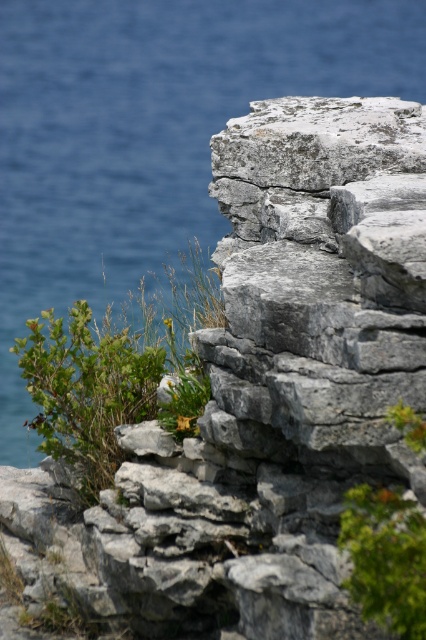
Question: Does blue water at upper left lie in front of green leafy bush at center-left?

Choices:
 (A) yes
 (B) no

Answer: (B)

Question: Is blue water at upper left bigger than green leafy plant at lower right?

Choices:
 (A) yes
 (B) no

Answer: (B)

Question: Which of the following is the farthest from the observer?

Choices:
 (A) green leafy bush at center-left
 (B) blue water at upper left

Answer: (B)

Question: Which point appears closest to the camera in this image?

Choices:
 (A) (74, 369)
 (B) (172, 145)
 (C) (416, 611)

Answer: (C)

Question: Can you confirm if blue water at upper left is positioned to the right of green leafy bush at center-left?

Choices:
 (A) no
 (B) yes

Answer: (A)

Question: Which of the following is the farthest from the observer?

Choices:
 (A) (405, 529)
 (B) (287, 92)
 (C) (75, 310)

Answer: (B)